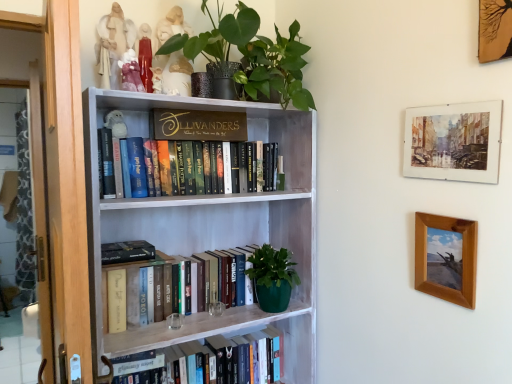
Question: Is watercolor paper painting at upper right, the second picture frame from the bottom, not near brown wooden picture frame at right, acting as the first picture frame starting from the bottom?

Choices:
 (A) yes
 (B) no

Answer: (B)

Question: Could you tell me if watercolor paper painting at upper right, the second picture frame from the bottom, is turned towards brown wooden picture frame at right, acting as the first picture frame starting from the bottom?

Choices:
 (A) no
 (B) yes

Answer: (A)

Question: Is watercolor paper painting at upper right, the second picture frame from the bottom, not within brown wooden picture frame at right, acting as the first picture frame starting from the bottom?

Choices:
 (A) no
 (B) yes

Answer: (B)

Question: Considering the relative sizes of watercolor paper painting at upper right, which appears as the second picture frame when viewed from the top, and brown wooden picture frame at right, acting as the first picture frame starting from the bottom, in the image provided, is watercolor paper painting at upper right, which appears as the second picture frame when viewed from the top, thinner than brown wooden picture frame at right, acting as the first picture frame starting from the bottom,?

Choices:
 (A) yes
 (B) no

Answer: (A)

Question: Would you say brown wooden picture frame at right, the 3th picture frame viewed from the top, is part of watercolor paper painting at upper right, the second picture frame from the bottom,'s contents?

Choices:
 (A) no
 (B) yes

Answer: (A)

Question: Considering the positions of green matte plant at upper center and wooden picture frame at upper right, arranged as the 3th picture frame when ordered from the bottom, in the image, is green matte plant at upper center bigger or smaller than wooden picture frame at upper right, arranged as the 3th picture frame when ordered from the bottom,?

Choices:
 (A) big
 (B) small

Answer: (A)

Question: Is green matte plant at upper center taller or shorter than wooden picture frame at upper right, arranged as the 3th picture frame when ordered from the bottom?

Choices:
 (A) short
 (B) tall

Answer: (B)

Question: Is green matte plant at upper center in front of or behind wooden picture frame at upper right, arranged as the 3th picture frame when ordered from the bottom, in the image?

Choices:
 (A) front
 (B) behind

Answer: (B)

Question: From a real-world perspective, relative to wooden picture frame at upper right, arranged as the 3th picture frame when ordered from the bottom, is green matte plant at upper center vertically above or below?

Choices:
 (A) below
 (B) above

Answer: (B)

Question: In terms of size, does porcelain figurine at upper center, which appears as the 3th toy when viewed from the top, appear bigger or smaller than matte porcelain figurine at upper center, which is the 2th toy from top to bottom?

Choices:
 (A) small
 (B) big

Answer: (A)

Question: In terms of width, does porcelain figurine at upper center, marked as the second toy in a bottom-to-top arrangement, look wider or thinner when compared to matte porcelain figurine at upper center, which is the 2th toy from top to bottom?

Choices:
 (A) thin
 (B) wide

Answer: (B)

Question: Does point (156, 82) appear closer or farther from the camera than point (137, 77)?

Choices:
 (A) farther
 (B) closer

Answer: (A)

Question: Considering their positions, is porcelain figurine at upper center, which appears as the 3th toy when viewed from the top, located in front of or behind matte porcelain figurine at upper center, which is the third toy from bottom to top?

Choices:
 (A) behind
 (B) front

Answer: (A)

Question: Is hardcover book at lower center, marked as the 4th book in a top-to-bottom arrangement, wider or thinner than green matte plant at upper center?

Choices:
 (A) thin
 (B) wide

Answer: (A)

Question: In the image, is hardcover book at lower center, which is counted as the first book, starting from the bottom, on the left side or the right side of green matte plant at upper center?

Choices:
 (A) right
 (B) left

Answer: (B)